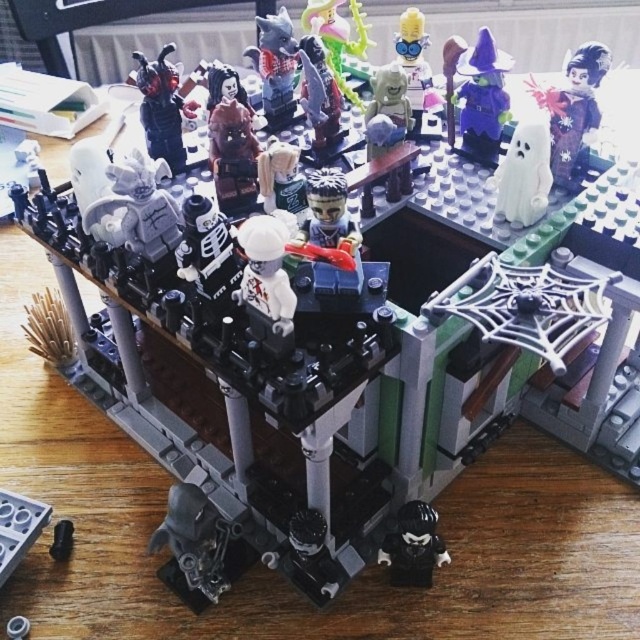
Between purple matte wizard hat at upper right and matte black figure at upper left, which one is positioned lower?

matte black figure at upper left is lower down.

Does purple matte wizard hat at upper right have a greater width compared to matte black figure at upper left?

Correct, the width of purple matte wizard hat at upper right exceeds that of matte black figure at upper left.

Is point (449, 70) positioned before point (173, 72)?

That is False.

Where is `purple matte wizard hat at upper right`? purple matte wizard hat at upper right is located at coordinates (477, 93).

Does purple matte wizard hat at upper right appear on the right side of black plastic figure at lower center?

Yes, purple matte wizard hat at upper right is to the right of black plastic figure at lower center.

Between purple matte wizard hat at upper right and black plastic figure at lower center, which one has more height?

Standing taller between the two is purple matte wizard hat at upper right.

Is point (493, 150) behind point (397, 552)?

Yes, point (493, 150) is farther from viewer.

This screenshot has height=640, width=640. Identify the location of purple matte wizard hat at upper right. (477, 93).

Does white matte minifigure at center have a greater height compared to matte black figure at upper left?

No.

Is point (291, 310) farther from camera compared to point (184, 150)?

No, (291, 310) is in front of (184, 150).

Is point (284, 250) farther from viewer compared to point (172, 93)?

No, it is in front of (172, 93).

Where is `white matte minifigure at center`? The height and width of the screenshot is (640, 640). white matte minifigure at center is located at coordinates (266, 269).